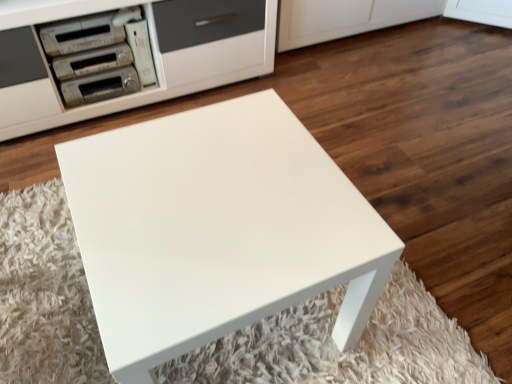
Identify the location of blank space above white glossy table at center (from a real-world perspective). (208, 182).